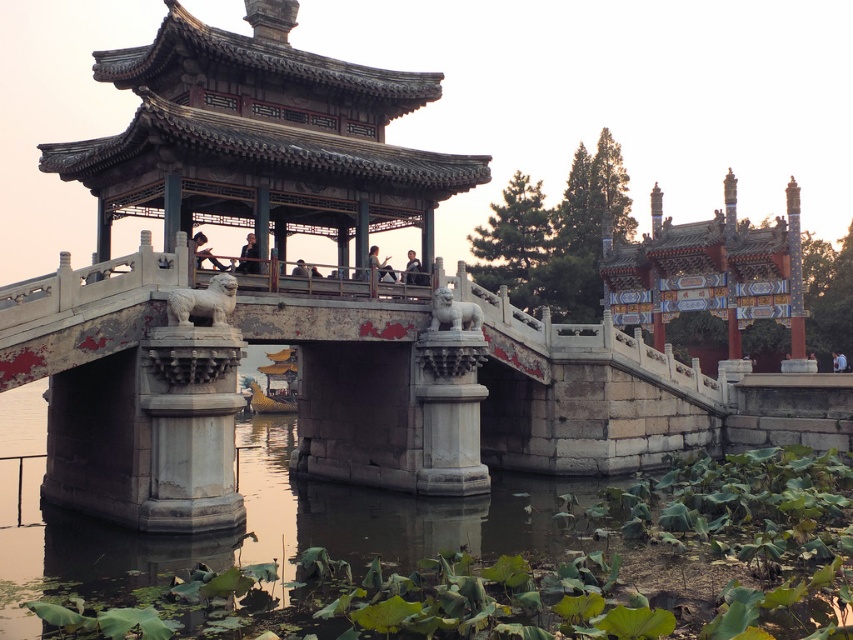
You are a tourist visiting the traditional Chinese architectural site. You want to take a photo that includes both the stone gazebo at center and the light brown wooden bridge at center. Which object should you position closer to the camera to ensure both are fully visible in the frame?

Since the stone gazebo at center is taller than the light brown wooden bridge at center, you should position the stone gazebo at center closer to the camera. This will help balance their sizes in the photo, ensuring both are fully visible.

Looking at this image, you are a tourist standing on the white stone bridge at center and want to take a photo of the stone gazebo at center. Since the bridge is in front of the gazebo, will you be able to capture the entire gazebo in your photo without any obstruction?

The white stone bridge at center is behind stone gazebo at center, so the gazebo is actually behind the bridge from your position. This means the bridge would block the view of the gazebo, making it impossible to capture the entire gazebo without obstruction.

You are standing on the stone bridge in the scene and want to move from the point at coordinates point (202, 253) to the point at coordinates point (409, 252). Which direction should you face to move towards the second point?

You should face backward because point (202, 253) is in front of point (409, 252), meaning the second point is behind the first one.